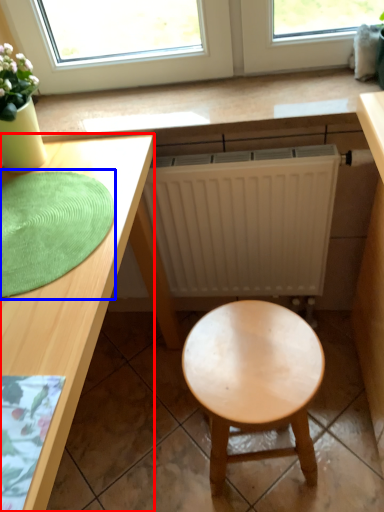
Question: Among these objects, which one is farthest to the camera, desk (highlighted by a red box) or mat (highlighted by a blue box)?

Choices:
 (A) desk
 (B) mat

Answer: (B)